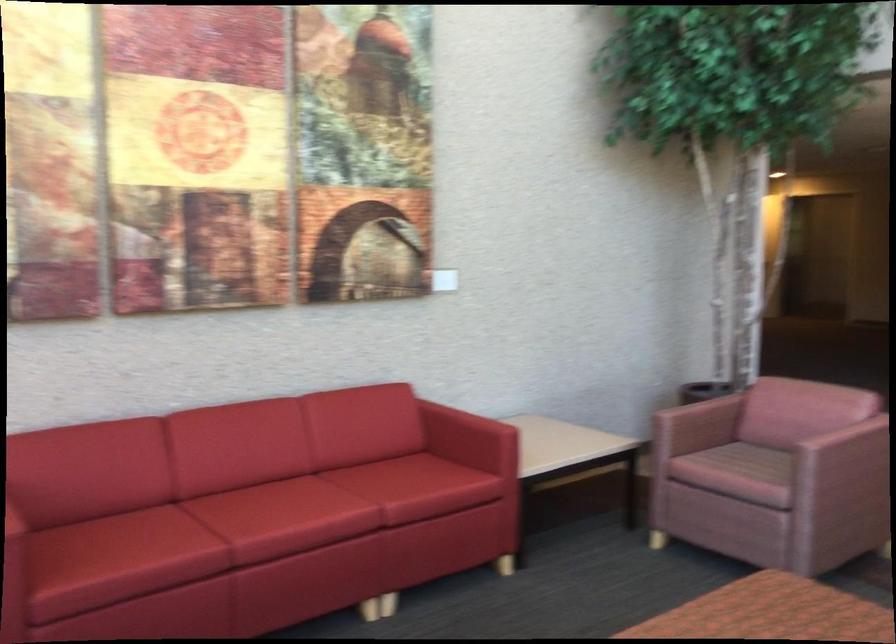
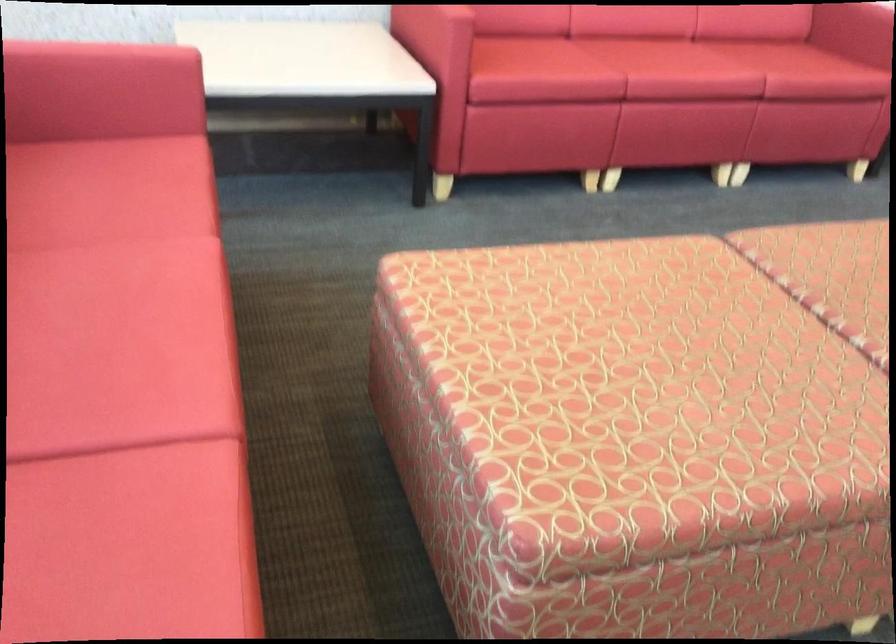
Question: Based on the continuous images, in which direction is the camera rotating? Reply with the corresponding letter.

Choices:
 (A) Left
 (B) Right
 (C) Up
 (D) Down

Answer: (D)